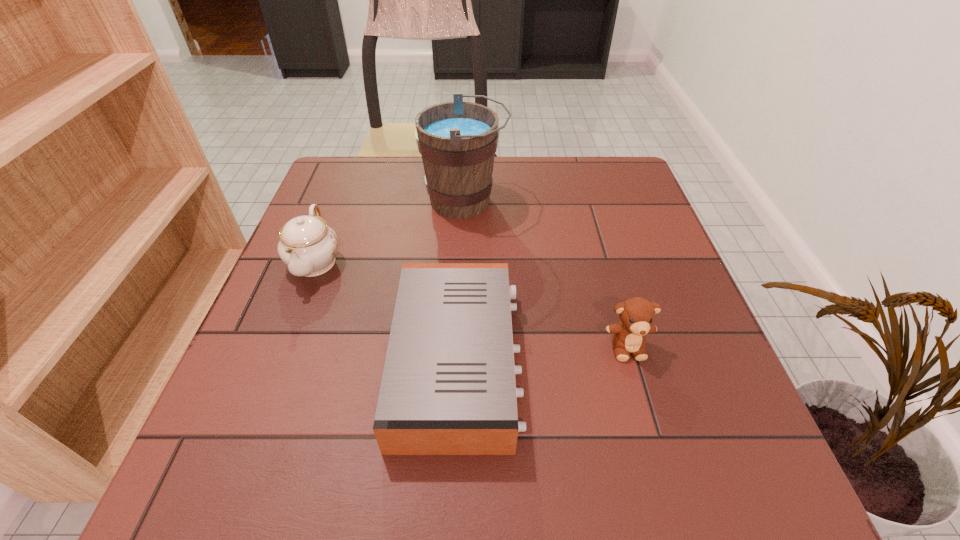
The height and width of the screenshot is (540, 960). I want to click on object positioned at the far edge, so click(457, 140).

The width and height of the screenshot is (960, 540). I want to click on object that is at the near edge, so click(x=448, y=387).

Identify the location of object that is at the left edge. The image size is (960, 540). pos(308,246).

You are a GUI agent. You are given a task and a screenshot of the screen. Output one action in this format:
    pyautogui.click(x=<x>, y=<y>)
    Task: Click on the object positioned at the right edge
    The height and width of the screenshot is (540, 960).
    Given the screenshot: What is the action you would take?
    pyautogui.click(x=637, y=314)

This screenshot has height=540, width=960. I want to click on vacant area at the far edge of the desktop, so click(399, 157).

This screenshot has width=960, height=540. I want to click on vacant region at the near edge, so click(478, 497).

In the image, there is a desktop. Find the location of `free space at the left edge`. free space at the left edge is located at coordinates (337, 305).

In the image, there is a desktop. Where is `vacant space at the right edge`? Image resolution: width=960 pixels, height=540 pixels. vacant space at the right edge is located at coordinates (662, 375).

The width and height of the screenshot is (960, 540). Find the location of `vacant region at the far left corner of the desktop`. vacant region at the far left corner of the desktop is located at coordinates (346, 183).

The height and width of the screenshot is (540, 960). I want to click on free space at the near left corner of the desktop, so click(x=201, y=495).